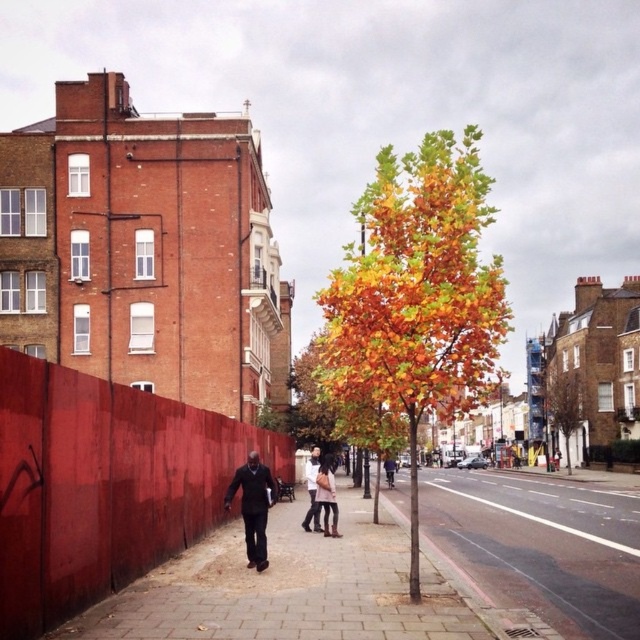
Question: Among these objects, which one is nearest to the camera?

Choices:
 (A) white cotton shirt at center
 (B) autumn leaves tree at center

Answer: (B)

Question: Which point appears closest to the camera in this image?

Choices:
 (A) (292, 388)
 (B) (77, 580)
 (C) (410, 285)
 (D) (273, 490)

Answer: (B)

Question: Where is autumn leaves at center located in relation to dark gray suit at center in the image?

Choices:
 (A) above
 (B) below

Answer: (A)

Question: Which point is farther to the camera?

Choices:
 (A) brown textured tree at center
 (B) red painted wooden fence at left

Answer: (A)

Question: Is red painted wooden fence at left to the right of autumn leaves tree at center from the viewer's perspective?

Choices:
 (A) yes
 (B) no

Answer: (B)

Question: Does red painted wooden fence at left come in front of brick pavement at left?

Choices:
 (A) no
 (B) yes

Answer: (B)